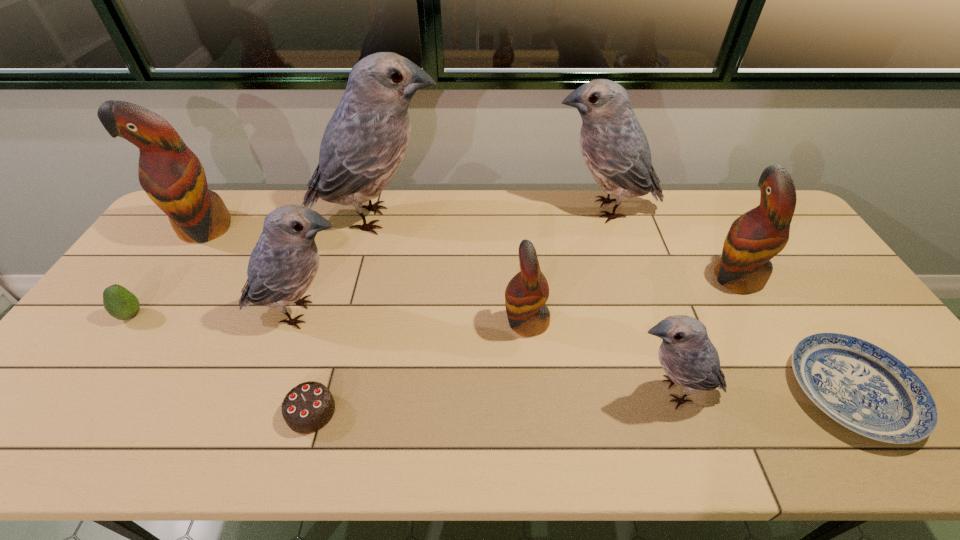
The width and height of the screenshot is (960, 540). In order to click on vacant space that's between the second shortest object and the third farthest gray parrot in this screenshot , I will do `click(307, 362)`.

This screenshot has height=540, width=960. Find the location of `vacant point located between the sixth object from left to right and the nearest parrot`. vacant point located between the sixth object from left to right and the nearest parrot is located at coordinates (599, 357).

This screenshot has height=540, width=960. Find the location of `object that stands as the eighth closest to the third smallest gray parrot`. object that stands as the eighth closest to the third smallest gray parrot is located at coordinates (173, 177).

Point out which object is positioned as the ninth nearest to the ninth tallest object. Please provide its 2D coordinates. Your answer should be formatted as a tuple, i.e. [(x, y)], where the tuple contains the x and y coordinates of a point satisfying the conditions above.

[(861, 386)]

Point out which parrot is positioned as the second nearest to the nearest parrot. Please provide its 2D coordinates. Your answer should be formatted as a tuple, i.e. [(x, y)], where the tuple contains the x and y coordinates of a point satisfying the conditions above.

[(754, 238)]

Locate an element on the screen. This screenshot has width=960, height=540. parrot object that ranks as the second closest to the rightmost red parrot is located at coordinates (686, 354).

Locate which gray parrot ranks fourth in proximity to the green avocado. Please provide its 2D coordinates. Your answer should be formatted as a tuple, i.e. [(x, y)], where the tuple contains the x and y coordinates of a point satisfying the conditions above.

[(686, 354)]

At what (x,y) coordinates should I click in order to perform the action: click on the closest gray parrot to the second biggest gray parrot. Please return your answer as a coordinate pair (x, y). The height and width of the screenshot is (540, 960). Looking at the image, I should click on (365, 141).

Identify the location of red parrot that is the third closest one to the second biggest gray parrot. (173, 177).

Identify which red parrot is located as the third nearest to the smallest gray parrot. Please provide its 2D coordinates. Your answer should be formatted as a tuple, i.e. [(x, y)], where the tuple contains the x and y coordinates of a point satisfying the conditions above.

[(173, 177)]